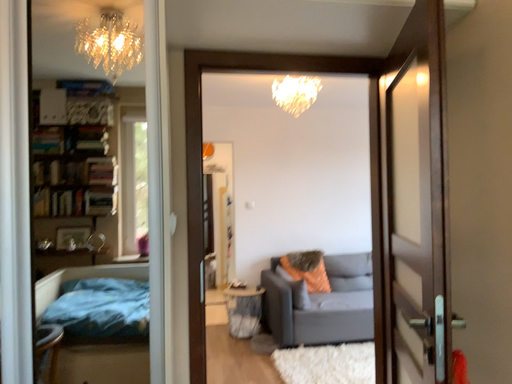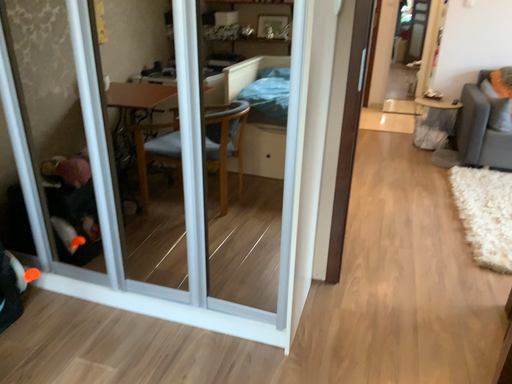
Question: How did the camera likely rotate when shooting the video?

Choices:
 (A) rotated downward
 (B) rotated upward

Answer: (A)